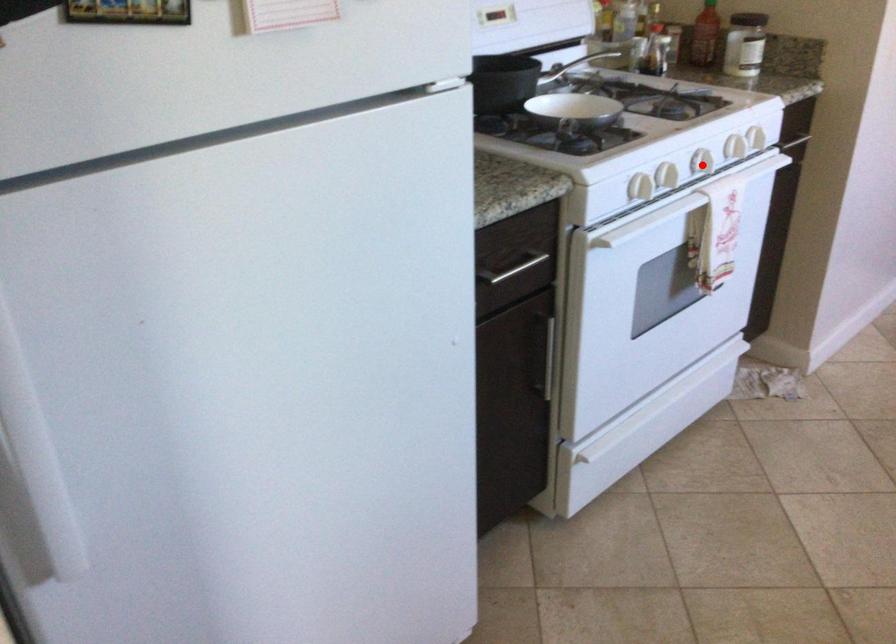
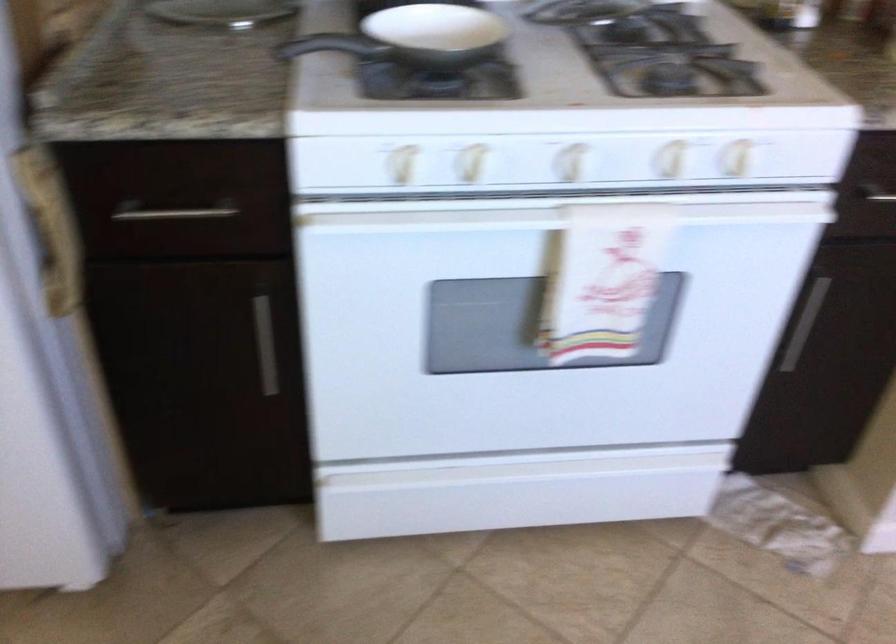
Where in the second image is the point corresponding to the highlighted location from the first image?

(550, 218)